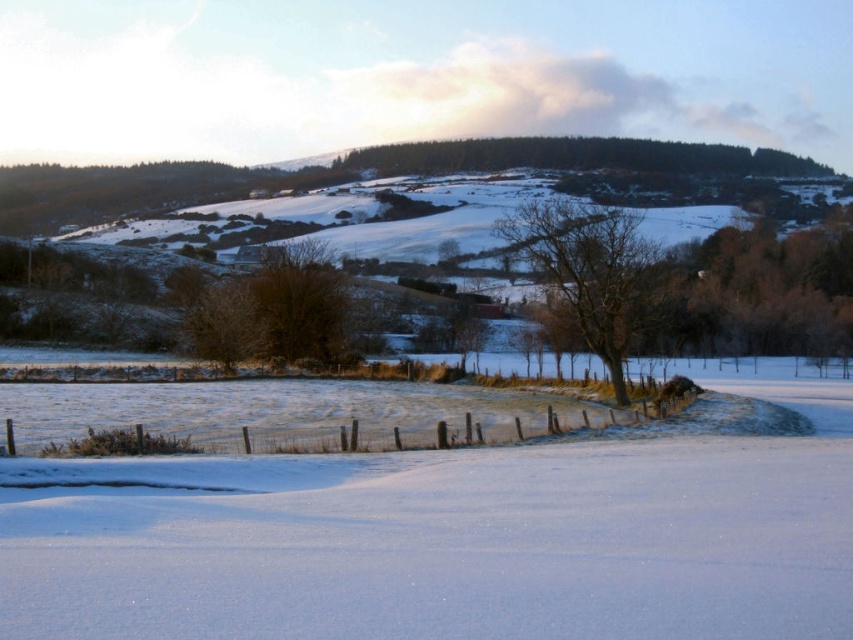
Question: Is white powdery snow at center smaller than bare wood tree at center?

Choices:
 (A) yes
 (B) no

Answer: (B)

Question: Is bare wood tree at center positioned behind wooden fence at center?

Choices:
 (A) yes
 (B) no

Answer: (A)

Question: Among these points, which one is farthest from the camera?

Choices:
 (A) (502, 440)
 (B) (560, 280)
 (C) (599, 536)

Answer: (B)

Question: Which object appears closest to the camera in this image?

Choices:
 (A) bare wood tree at center
 (B) white powdery snow at center

Answer: (B)

Question: Estimate the real-world distances between objects in this image. Which object is closer to the bare wood tree at center?

Choices:
 (A) wooden fence at center
 (B) white powdery snow at center

Answer: (A)

Question: Does white powdery snow at center appear over wooden fence at center?

Choices:
 (A) no
 (B) yes

Answer: (B)